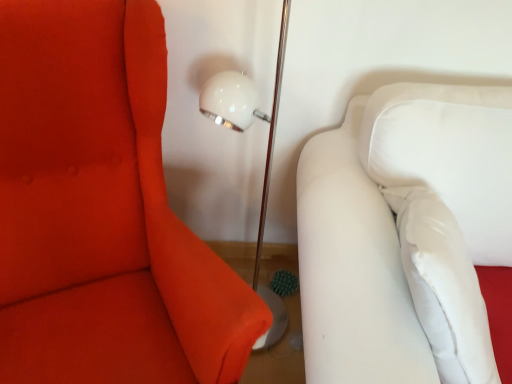
Question: Is matte white sofa at right, positioned as the first furniture in left-to-right order, to the right of white fabric couch at right, the first furniture viewed from the right, from the viewer's perspective?

Choices:
 (A) yes
 (B) no

Answer: (B)

Question: Is matte white sofa at right, arranged as the second furniture when viewed from the right, shorter than white fabric couch at right, the first furniture viewed from the right?

Choices:
 (A) no
 (B) yes

Answer: (A)

Question: Is matte white sofa at right, arranged as the second furniture when viewed from the right, not close to white fabric couch at right, the first furniture viewed from the right?

Choices:
 (A) no
 (B) yes

Answer: (A)

Question: From a real-world perspective, is matte white sofa at right, positioned as the first furniture in left-to-right order, physically below white fabric couch at right, the first furniture viewed from the right?

Choices:
 (A) no
 (B) yes

Answer: (A)

Question: Considering the relative sizes of matte white sofa at right, arranged as the second furniture when viewed from the right, and white fabric couch at right, the first furniture viewed from the right, in the image provided, is matte white sofa at right, arranged as the second furniture when viewed from the right, bigger than white fabric couch at right, the first furniture viewed from the right,?

Choices:
 (A) no
 (B) yes

Answer: (A)

Question: Can you confirm if matte white sofa at right, arranged as the second furniture when viewed from the right, is thinner than white fabric couch at right, marked as the second furniture in a left-to-right arrangement?

Choices:
 (A) yes
 (B) no

Answer: (B)

Question: Would you consider white fabric couch at right, the first furniture viewed from the right, to be distant from matte white sofa at right, positioned as the first furniture in left-to-right order?

Choices:
 (A) yes
 (B) no

Answer: (B)

Question: Can you confirm if white fabric couch at right, marked as the second furniture in a left-to-right arrangement, is shorter than matte white sofa at right, arranged as the second furniture when viewed from the right?

Choices:
 (A) yes
 (B) no

Answer: (A)

Question: Is white fabric couch at right, the first furniture viewed from the right, oriented away from matte white sofa at right, positioned as the first furniture in left-to-right order?

Choices:
 (A) yes
 (B) no

Answer: (B)

Question: Is white fabric couch at right, the first furniture viewed from the right, next to matte white sofa at right, positioned as the first furniture in left-to-right order, and touching it?

Choices:
 (A) no
 (B) yes

Answer: (A)

Question: Is white fabric couch at right, the first furniture viewed from the right, closer to camera compared to matte white sofa at right, positioned as the first furniture in left-to-right order?

Choices:
 (A) no
 (B) yes

Answer: (A)

Question: Could you tell me if white fabric couch at right, the first furniture viewed from the right, is facing matte white sofa at right, arranged as the second furniture when viewed from the right?

Choices:
 (A) no
 (B) yes

Answer: (A)

Question: Looking at the image, does matte white sofa at right, arranged as the second furniture when viewed from the right, seem bigger or smaller compared to white fabric couch at right, the first furniture viewed from the right?

Choices:
 (A) small
 (B) big

Answer: (A)